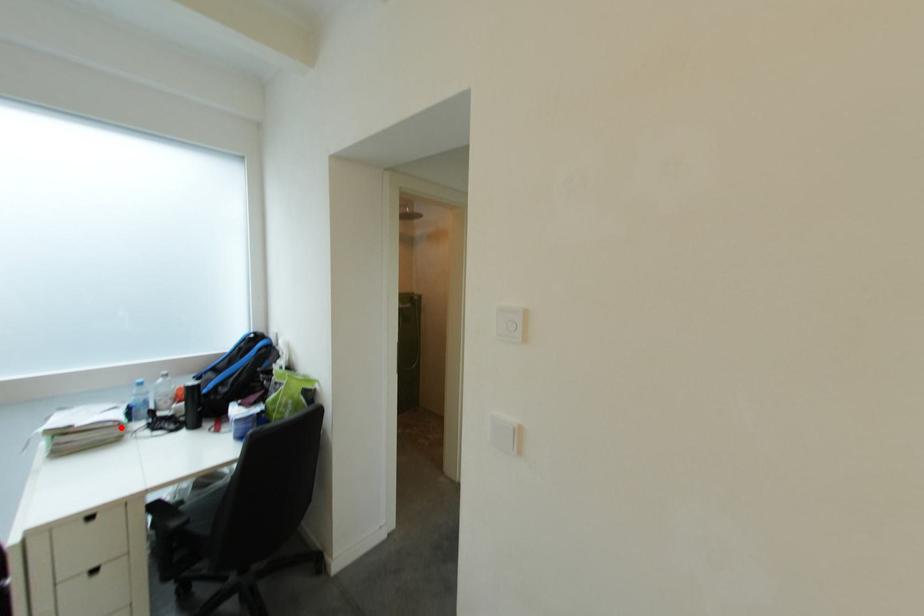
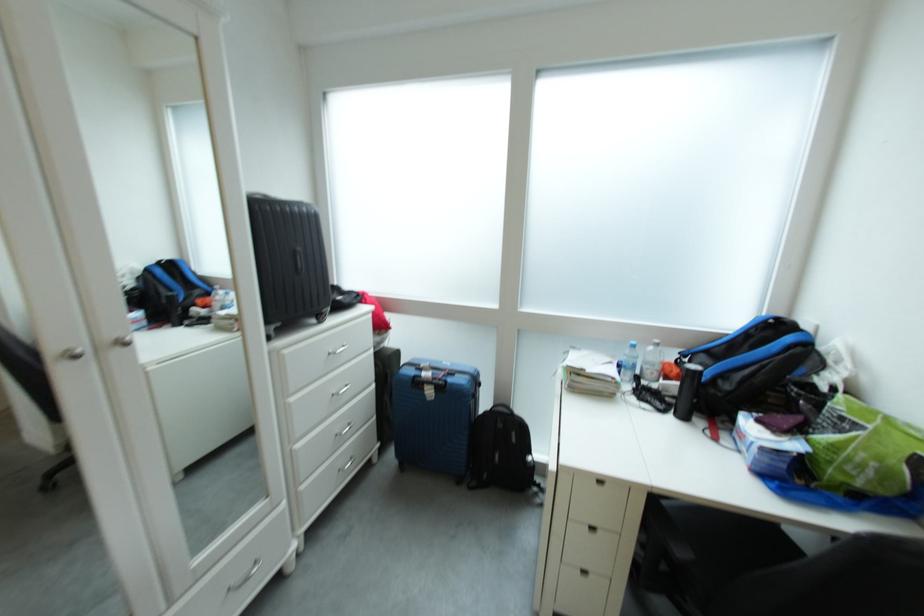
Locate, in the second image, the point that corresponds to the highlighted location in the first image.

(622, 383)